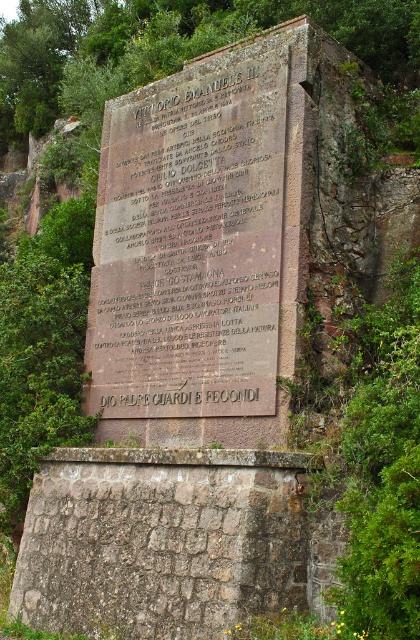
From the picture: You are standing in front of a historical monument surrounded by greenery. You see a dark brown stone plaque at center and a rusty stone wall at center. Which object is positioned to the right of the other?

The dark brown stone plaque at center is to the right of the rusty stone wall at center.

You are an archaeologist examining the monument. You notice the dark brown stone plaque at center and the rusty stone wall at center. Which object is taller?

The dark brown stone plaque at center is taller than the rusty stone wall at center.